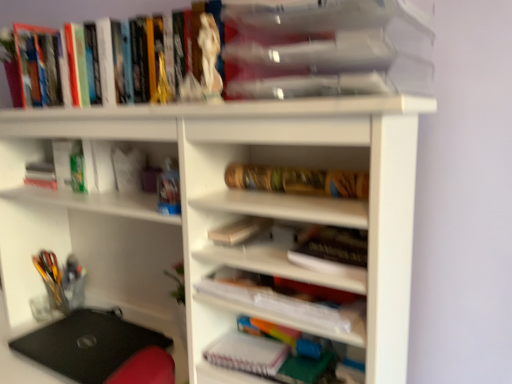
Identify the location of empty space that is ontop of black matte laptop at lower left (from a real-world perspective). Image resolution: width=512 pixels, height=384 pixels. (93, 336).